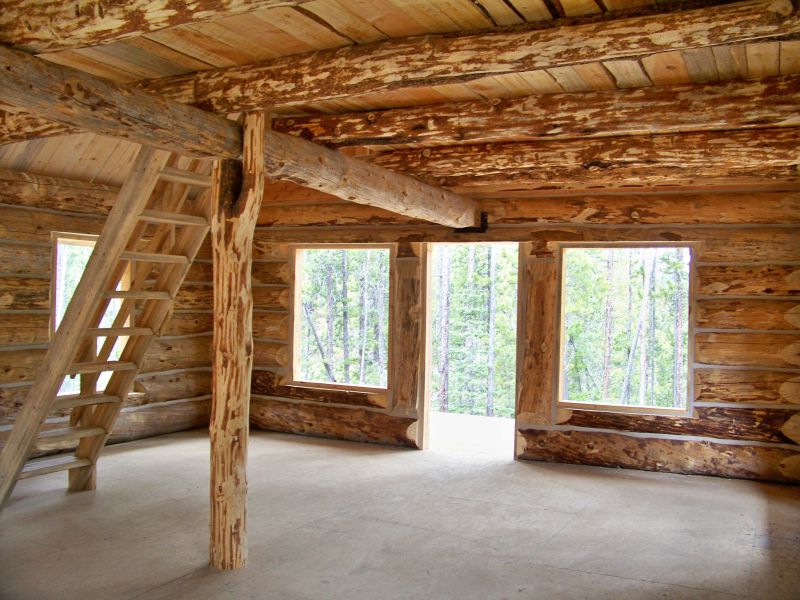
What are the coordinates of `shadow on floor beneath window` in the screenshot? It's located at (602, 475).